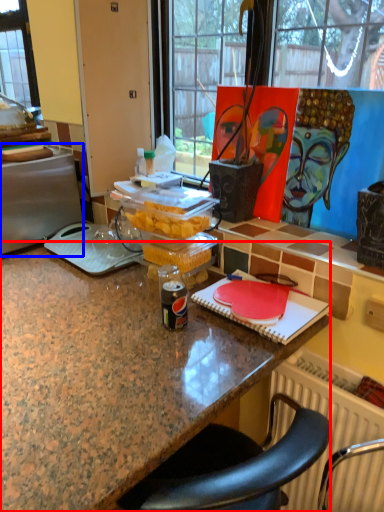
Question: Which point is closer to the camera, desk (highlighted by a red box) or appliance (highlighted by a blue box)?

Choices:
 (A) desk
 (B) appliance

Answer: (A)